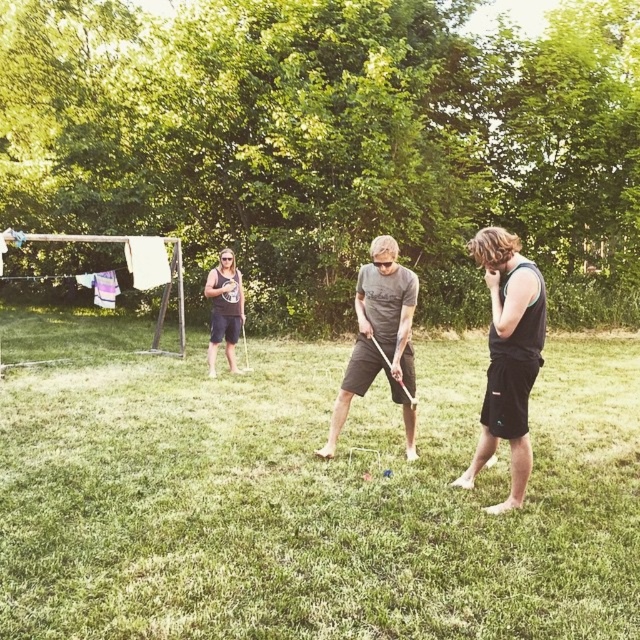
Question: Which point is farther from the camera taking this photo?

Choices:
 (A) (518, 320)
 (B) (412, 436)

Answer: (B)

Question: Which point is closer to the camera?

Choices:
 (A) (214, 604)
 (B) (92, 275)
 (C) (531, 461)
 (D) (209, 369)

Answer: (A)

Question: Which point appears farthest from the camera in this image?

Choices:
 (A) (211, 353)
 (B) (356, 364)
 (C) (538, 342)

Answer: (A)

Question: Is dark gray t-shirt at center wider than white cotton shirt at left?

Choices:
 (A) yes
 (B) no

Answer: (A)

Question: Is black matte tank top at right above dark gray t-shirt at center?

Choices:
 (A) yes
 (B) no

Answer: (B)

Question: Does green grass at center lie in front of matte black tank top at center?

Choices:
 (A) no
 (B) yes

Answer: (B)